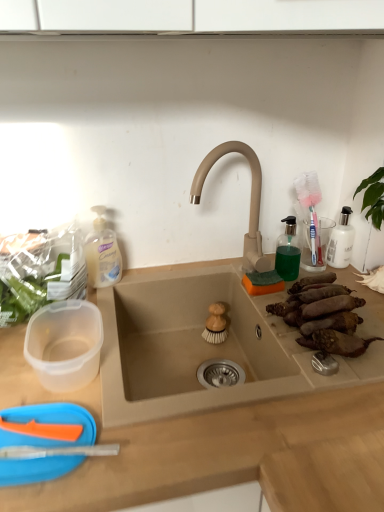
You are a GUI agent. You are given a task and a screenshot of the screen. Output one action in this format:
    pyautogui.click(x=<x>, y=<y>)
    Task: Click on the free space that is to the left of transparent plastic soap dispenser at upper right
    
    Given the screenshot: What is the action you would take?
    pyautogui.click(x=237, y=279)